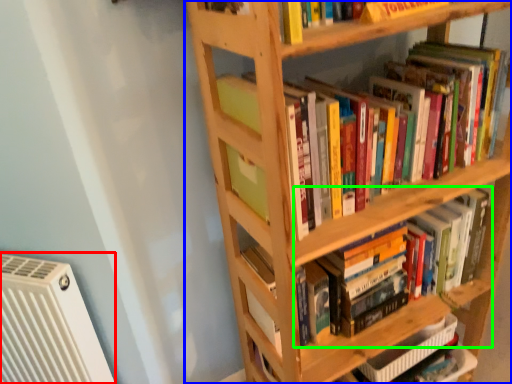
Question: Which is farther away from air conditioning (highlighted by a red box)? shelf (highlighted by a blue box) or book (highlighted by a green box)?

Choices:
 (A) shelf
 (B) book

Answer: (B)